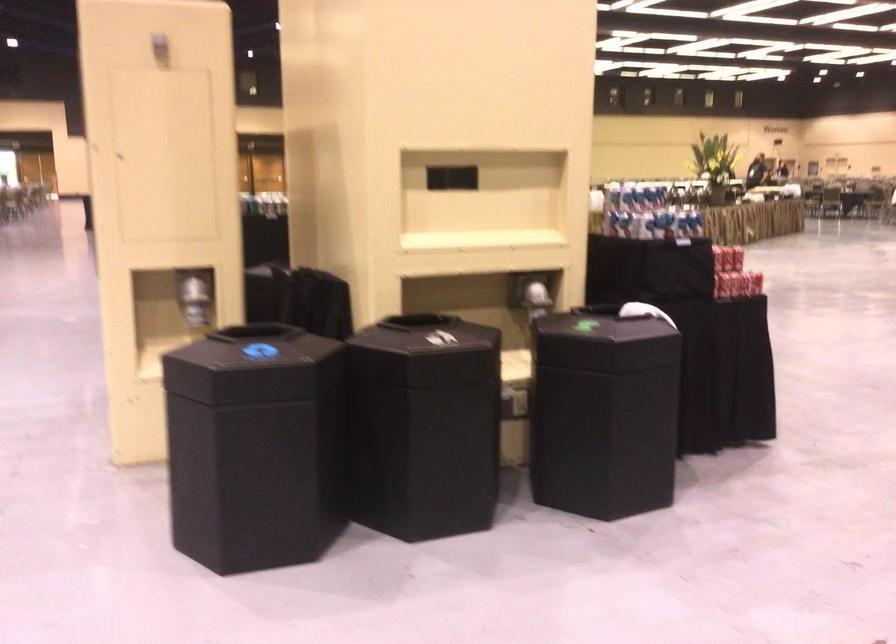
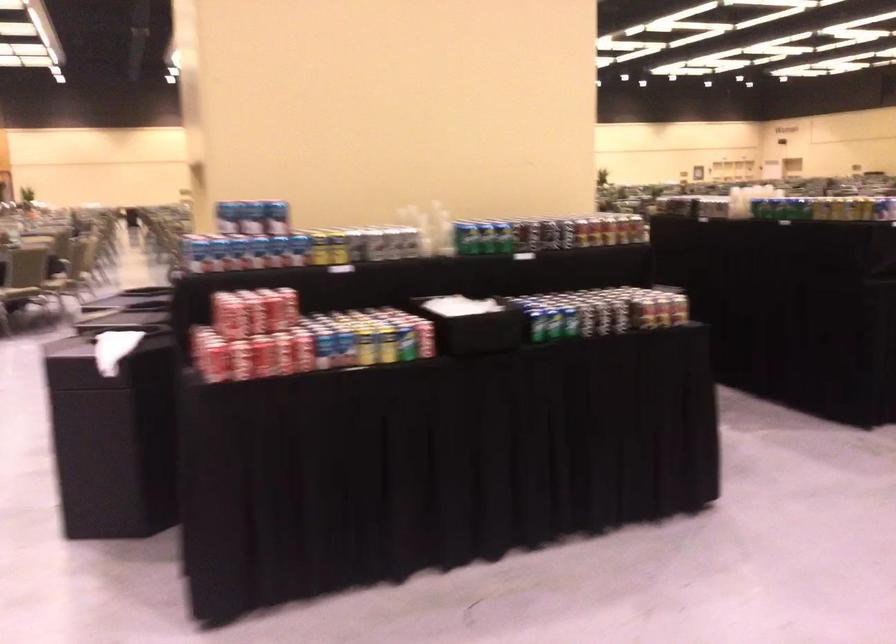
Find the pixel in the second image that matches pixel 659 196 in the first image.

(257, 216)